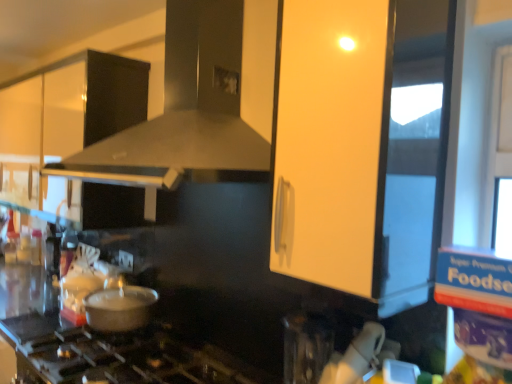
Question: Is matte black vent at center outside of matte white cabinet at upper center?

Choices:
 (A) yes
 (B) no

Answer: (A)

Question: Is matte white cabinet at upper center at the back of matte black vent at center?

Choices:
 (A) no
 (B) yes

Answer: (A)

Question: Would you say matte black vent at center is a long distance from matte white cabinet at upper center?

Choices:
 (A) yes
 (B) no

Answer: (B)

Question: Does matte black vent at center have a greater height compared to matte white cabinet at upper center?

Choices:
 (A) yes
 (B) no

Answer: (B)

Question: From a real-world perspective, is matte black vent at center positioned under matte white cabinet at upper center based on gravity?

Choices:
 (A) yes
 (B) no

Answer: (B)

Question: Is the position of matte black vent at center less distant than that of matte white cabinet at upper center?

Choices:
 (A) no
 (B) yes

Answer: (A)

Question: Does metallic silver pot at lower left have a smaller size compared to white glossy cabinet at upper left?

Choices:
 (A) yes
 (B) no

Answer: (A)

Question: Is metallic silver pot at lower left beside white glossy cabinet at upper left?

Choices:
 (A) yes
 (B) no

Answer: (B)

Question: Is metallic silver pot at lower left at the left side of white glossy cabinet at upper left?

Choices:
 (A) yes
 (B) no

Answer: (B)

Question: Can you confirm if metallic silver pot at lower left is taller than white glossy cabinet at upper left?

Choices:
 (A) no
 (B) yes

Answer: (A)

Question: From the image's perspective, is metallic silver pot at lower left above white glossy cabinet at upper left?

Choices:
 (A) no
 (B) yes

Answer: (A)

Question: Considering the relative sizes of metallic silver pot at lower left and white glossy cabinet at upper left in the image provided, is metallic silver pot at lower left shorter than white glossy cabinet at upper left?

Choices:
 (A) yes
 (B) no

Answer: (A)

Question: Does white glossy cabinet at upper left have a greater width compared to metallic silver pot at lower left?

Choices:
 (A) no
 (B) yes

Answer: (B)